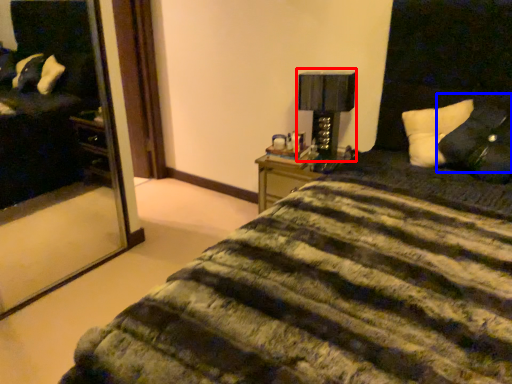
Question: Which object is further to the camera taking this photo, table lamp (highlighted by a red box) or pillow (highlighted by a blue box)?

Choices:
 (A) table lamp
 (B) pillow

Answer: (A)